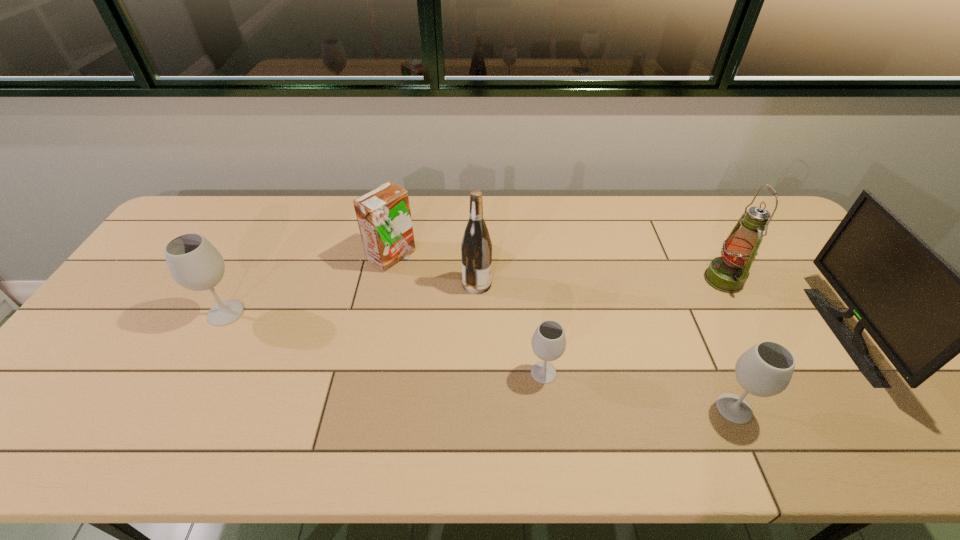
Please point a spot to place another wineglass for symmetrical spacing. Please provide its 2D coordinates. Your answer should be formatted as a tuple, i.e. [(x, y)], where the tuple contains the x and y coordinates of a point satisfying the conditions above.

[(375, 341)]